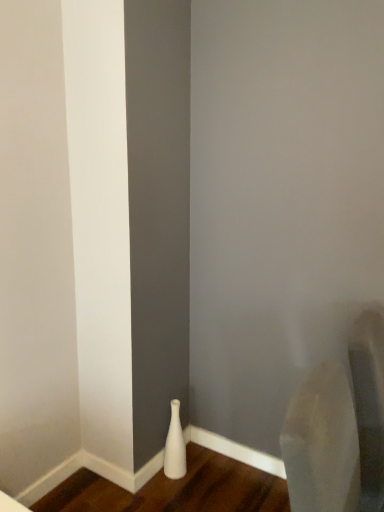
I want to click on free space in front of white glossy vase at lower left, so click(x=175, y=493).